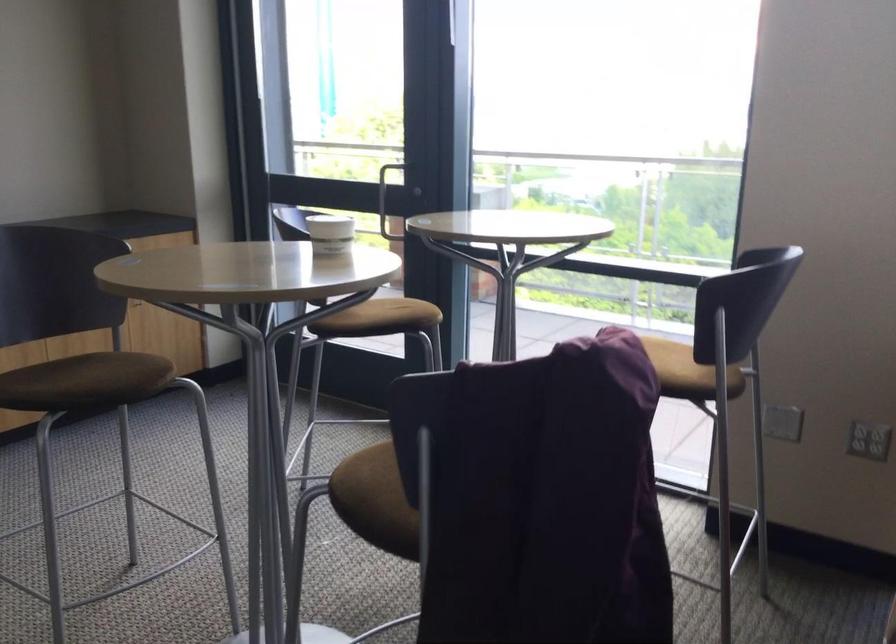
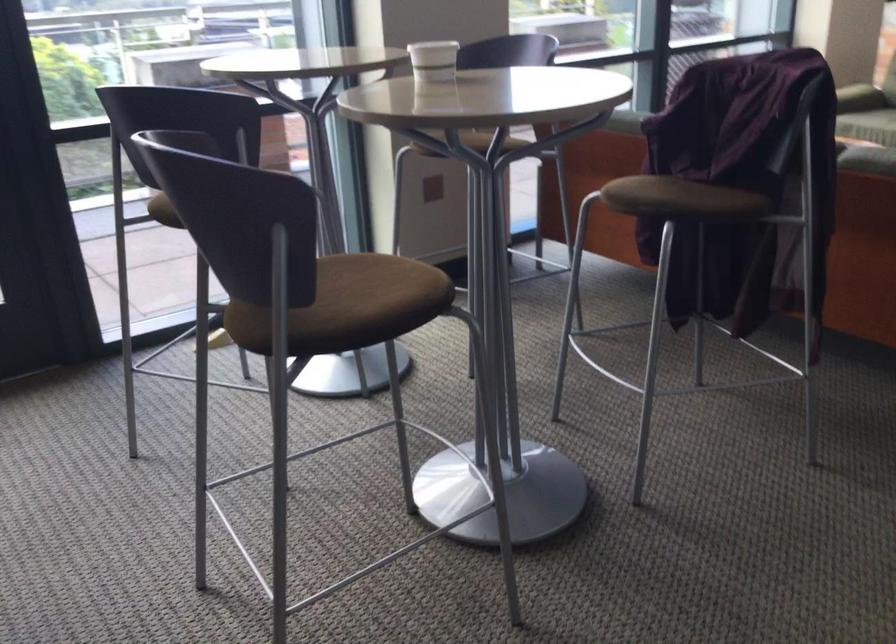
The point at (357, 307) is marked in the first image. Where is the corresponding point in the second image?

(162, 211)